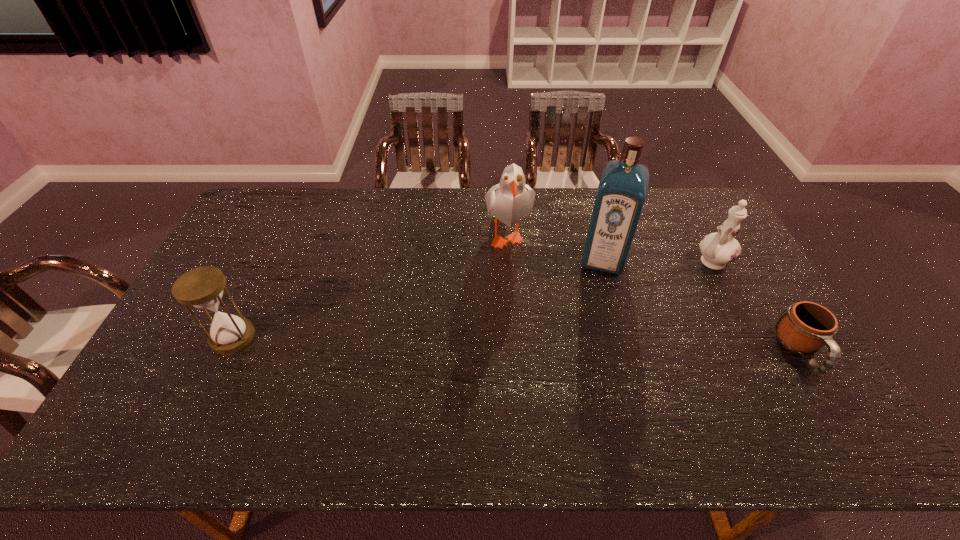
Locate an element on the screen. object that is the closest to the second tallest object is located at coordinates (621, 194).

Locate an element on the screen. free space that satisfies the following two spatial constraints: 1. on the front side of the third object from left to right; 2. on the right side of the chinaware is located at coordinates (604, 261).

Locate an element on the screen. free spot that satisfies the following two spatial constraints: 1. on the back side of the tallest object; 2. on the left side of the hourglass is located at coordinates (270, 259).

Locate an element on the screen. The width and height of the screenshot is (960, 540). free space that satisfies the following two spatial constraints: 1. on the front side of the gull; 2. on the left side of the chinaware is located at coordinates (509, 261).

The image size is (960, 540). I want to click on vacant region that satisfies the following two spatial constraints: 1. on the back side of the tallest object; 2. on the left side of the hourglass, so click(270, 259).